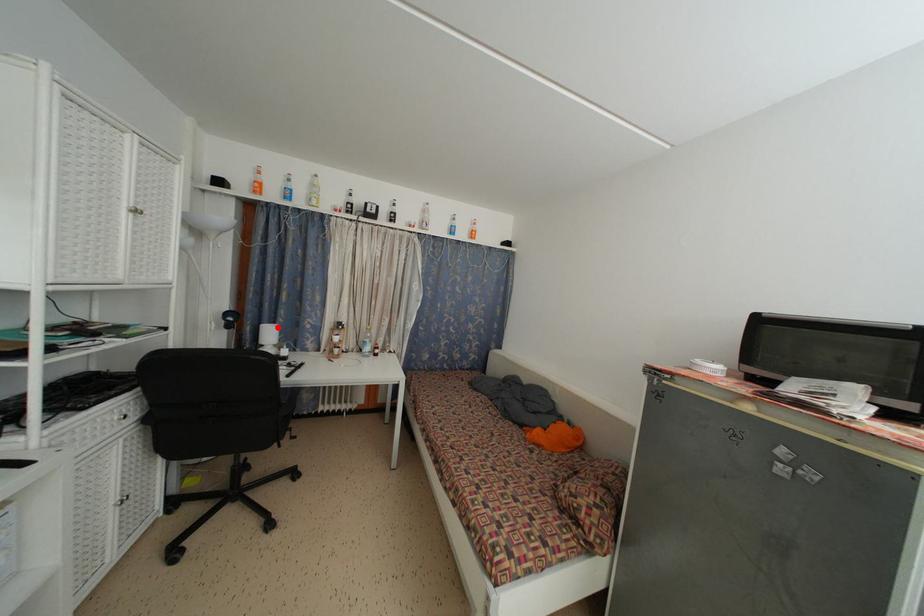
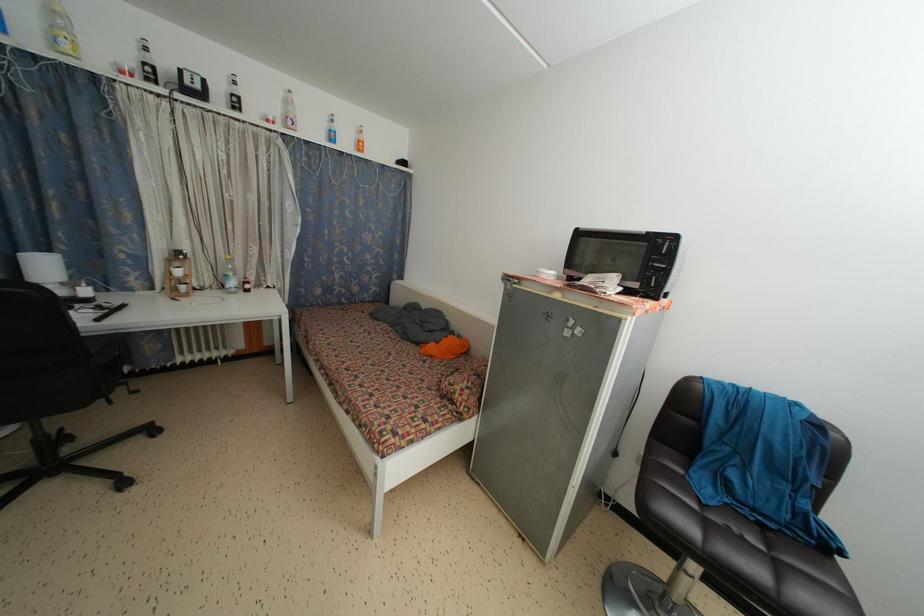
Where in the second image is the point corresponding to the highlighted location from the first image?

(52, 254)